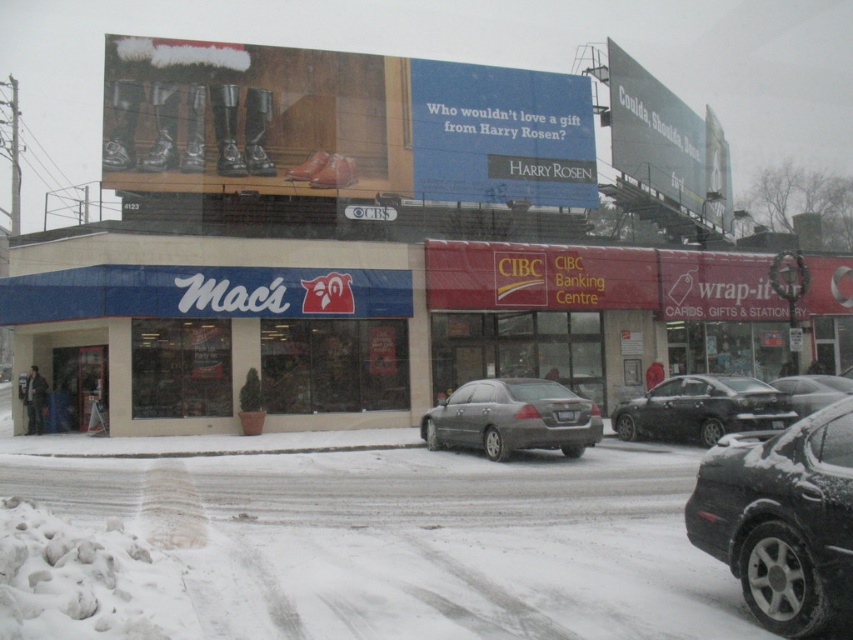
From the picture: You are a delivery person trying to park your van between the two sedans in the snowy street. The van is 2 meters long. Can you fit it between the matte gray sedan at center and the metallic silver sedan at center?

The matte gray sedan at center is closer to the viewer than the metallic silver sedan at center, so the distance between them is not specified. Therefore, it is uncertain if the van can fit between them without more information about the space available.

Consider the image. You are standing at the entrance of Macs store on the left side of the image. Looking towards the center of the road, you see a point marked at coordinates (512,419). What object is located at those coordinates?

The point at coordinates (512,419) represents the location of the matte gray sedan at center.